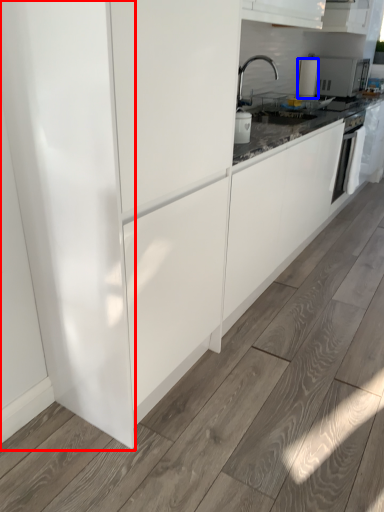
Question: Which object appears closest to the camera in this image, glass door (highlighted by a red box) or kitchen appliance (highlighted by a blue box)?

Choices:
 (A) glass door
 (B) kitchen appliance

Answer: (A)